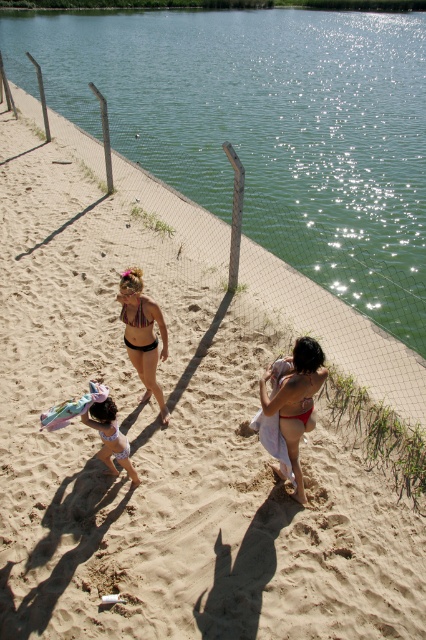
You are a lifeguard standing at the center of the beach. You notice a red matte bikini at lower right. Where exactly is the red matte bikini located in relation to your position?

The red matte bikini at lower right is located at the coordinates point (296, 401) relative to the image frame.

You are a photographer trying to capture a photo of both the red matte bikini at lower right and the white matte bikini at center. Since you want to include both in the frame, which bikini should you focus on first to ensure both are in the shot?

You should focus on the red matte bikini at lower right first because it is much taller than the white matte bikini at center, so adjusting the camera angle to include its height will naturally include the smaller one as well.